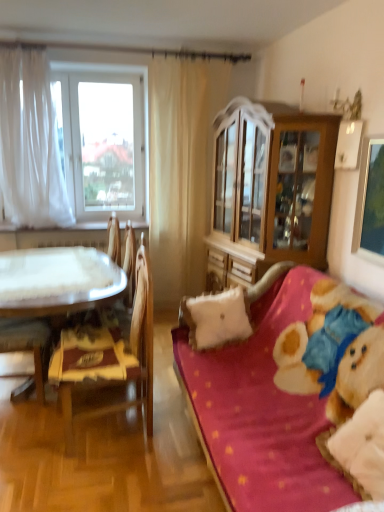
Identify the location of blank space situated above white sheer curtain at left (from a real-world perspective). The width and height of the screenshot is (384, 512). (87, 67).